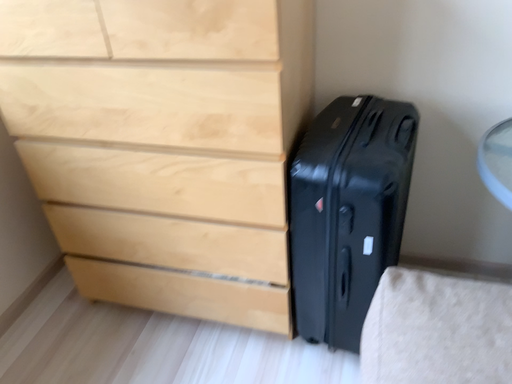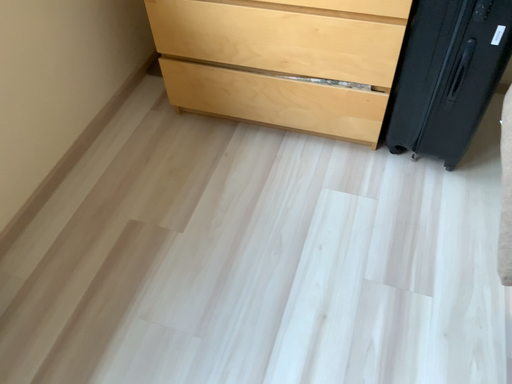
Question: Which way did the camera rotate in the video?

Choices:
 (A) rotated downward
 (B) rotated upward

Answer: (A)